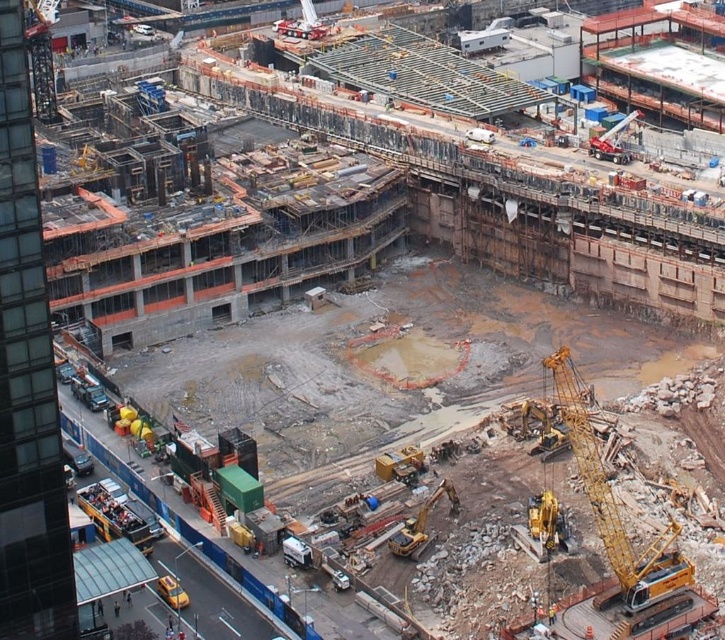
Can you confirm if yellow metallic excavator at lower right is shorter than yellow metallic excavator at center?

No, yellow metallic excavator at lower right is not shorter than yellow metallic excavator at center.

Between yellow metallic excavator at lower right and yellow metallic excavator at center, which one is positioned higher?

yellow metallic excavator at center is above.

Is point (415, 532) closer to viewer compared to point (406, 454)?

Yes, it is in front of point (406, 454).

This screenshot has height=640, width=725. I want to click on yellow metallic excavator at lower right, so click(x=420, y=524).

What do you see at coordinates (624, 545) in the screenshot?
I see `yellow metallic crane at lower right` at bounding box center [624, 545].

Is yellow metallic crane at lower right thinner than yellow metallic excavator at center?

Incorrect, yellow metallic crane at lower right's width is not less than yellow metallic excavator at center's.

Which is behind, point (618, 580) or point (389, 472)?

Point (389, 472)

The height and width of the screenshot is (640, 725). In order to click on yellow metallic crane at lower right in this screenshot , I will do `click(624, 545)`.

Consider the image. Who is more distant from viewer, (x=683, y=584) or (x=428, y=509)?

The point (x=428, y=509) is more distant.

Does point (587, 612) lie behind point (394, 547)?

That is False.

Locate an element on the screen. yellow metallic crane at lower right is located at coordinates (624, 545).